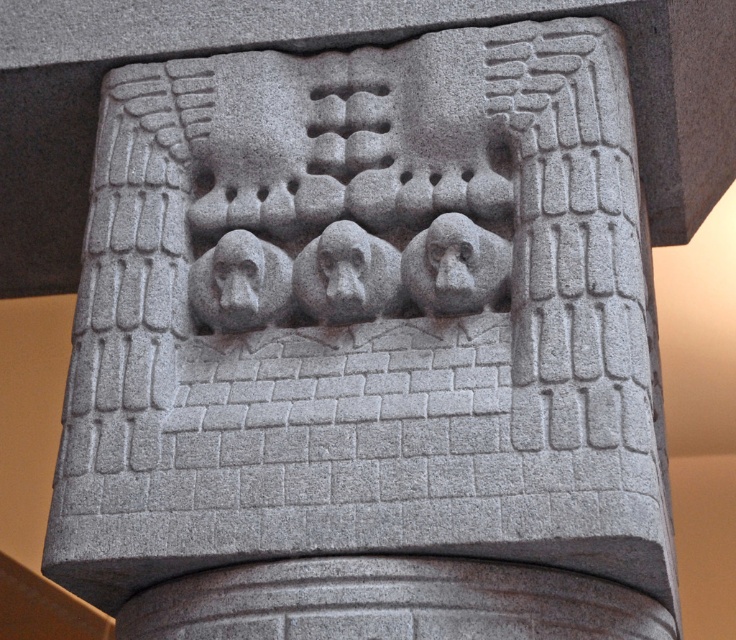
Question: Which object appears farthest from the camera in this image?

Choices:
 (A) gray stone monkey at center
 (B) granite monkey at center

Answer: (A)

Question: Can you confirm if granite monkey at center is wider than gray stone monkey at center?

Choices:
 (A) no
 (B) yes

Answer: (B)

Question: Is gray stone monkeys at center to the left of gray stone monkey at center from the viewer's perspective?

Choices:
 (A) yes
 (B) no

Answer: (B)

Question: Which of the following is the closest to the observer?

Choices:
 (A) (500, 272)
 (B) (319, 284)

Answer: (A)

Question: Which object is the closest to the gray stone monkey at center?

Choices:
 (A) gray stone monkeys at center
 (B) granite monkey at center

Answer: (A)

Question: Can you confirm if granite monkey at center is positioned to the left of gray stone monkey at center?

Choices:
 (A) no
 (B) yes

Answer: (A)